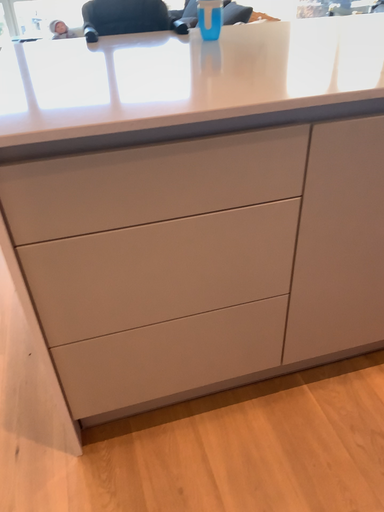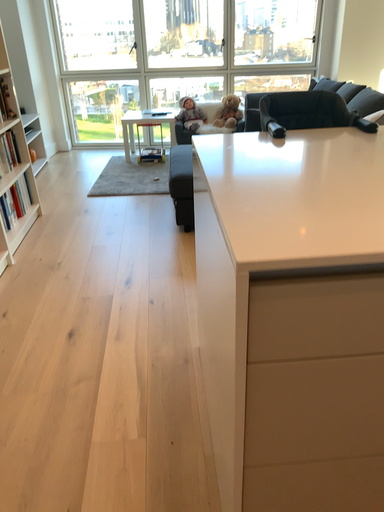
Question: How did the camera likely rotate when shooting the video?

Choices:
 (A) rotated downward
 (B) rotated upward

Answer: (B)